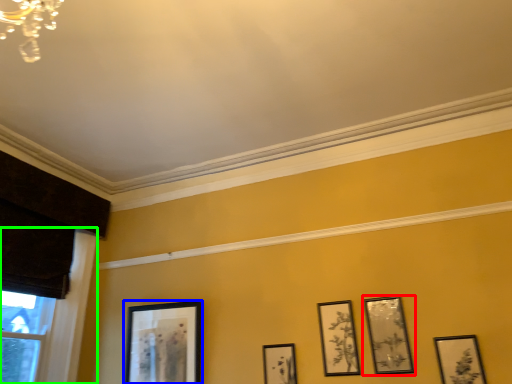
Question: Which object is the closest to the picture frame (highlighted by a red box)? Choose among these: picture frame (highlighted by a blue box) or window frame (highlighted by a green box).

Choices:
 (A) picture frame
 (B) window frame

Answer: (A)